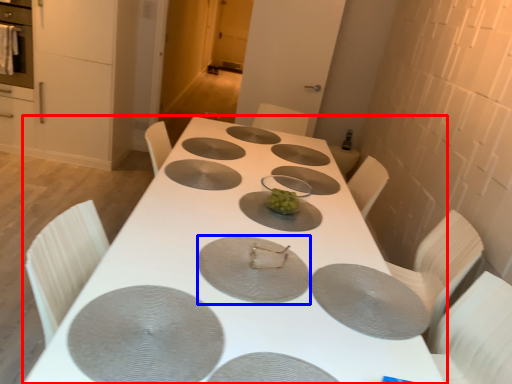
Question: Among these objects, which one is nearest to the camera, table (highlighted by a red box) or pizza pan (highlighted by a blue box)?

Choices:
 (A) table
 (B) pizza pan

Answer: (A)